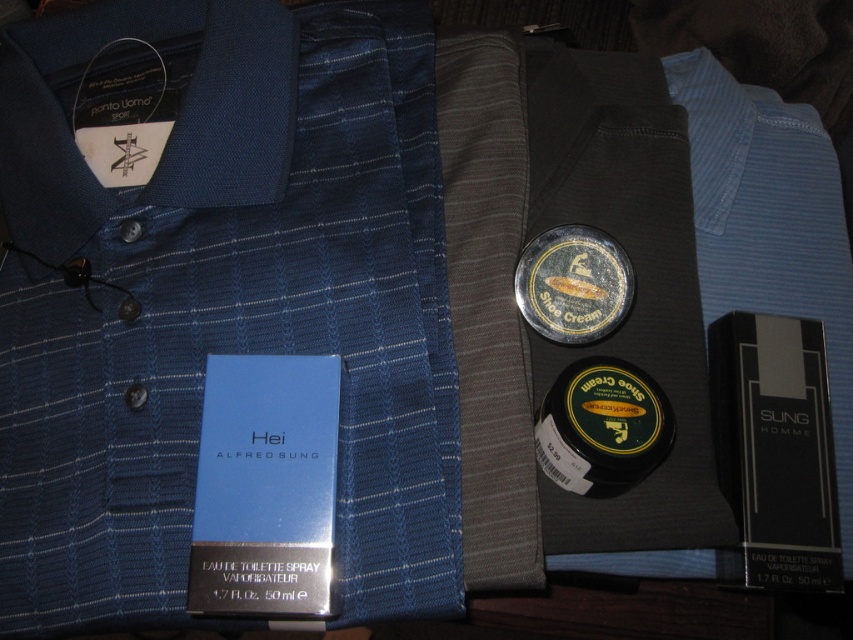
Question: Does blue cardboard box at center have a smaller size compared to green matte shoe cream at center?

Choices:
 (A) no
 (B) yes

Answer: (A)

Question: Which point is farther from the camera taking this photo?

Choices:
 (A) (134, 584)
 (B) (569, 340)
 (C) (293, 499)

Answer: (B)

Question: Which point is closer to the camera?

Choices:
 (A) green matte shoe cream at center
 (B) blue woven dress shirt at center

Answer: (B)

Question: Can you confirm if blue woven dress shirt at center is positioned to the left of green matte shoe cream at center?

Choices:
 (A) no
 (B) yes

Answer: (B)

Question: Estimate the real-world distances between objects in this image. Which object is closer to the green matte shoe cream at center?

Choices:
 (A) blue woven dress shirt at center
 (B) blue cardboard box at center

Answer: (B)

Question: Does blue cardboard box at center have a greater width compared to green matte shoe cream at center?

Choices:
 (A) no
 (B) yes

Answer: (B)